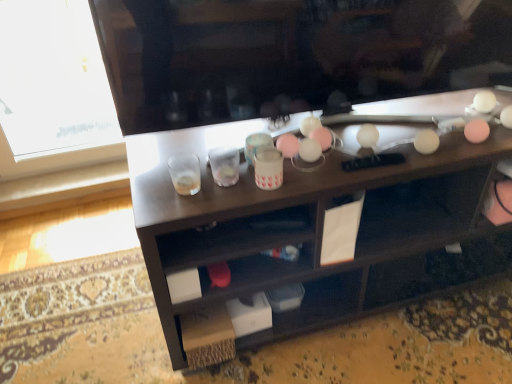
Find the location of a particular element. vacant area that is situated to the right of clear plastic shot glass at center, the 1th shot glass from the right is located at coordinates (297, 173).